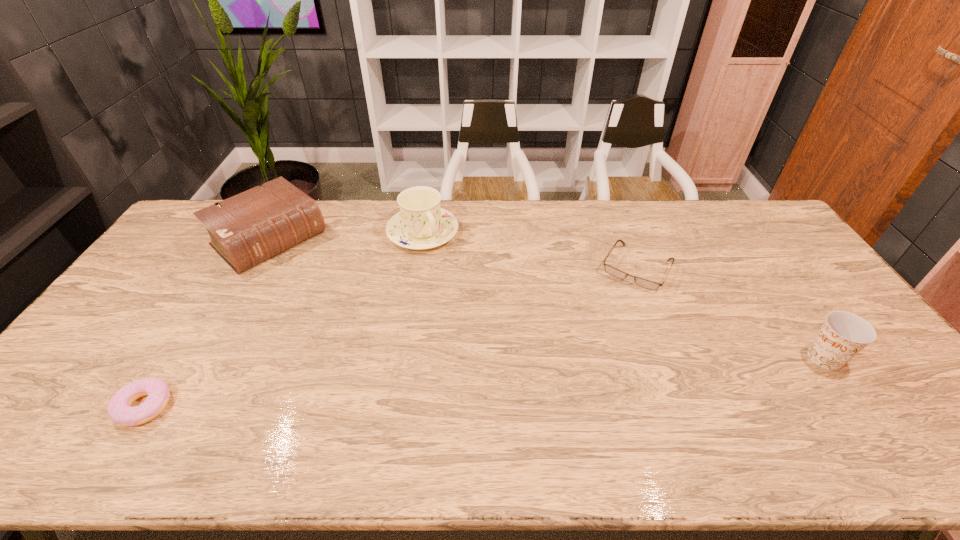
At what (x,y) coordinates should I click in order to perform the action: click on object situated at the left edge. Please return your answer as a coordinate pair (x, y). The width and height of the screenshot is (960, 540). Looking at the image, I should click on (249, 228).

The height and width of the screenshot is (540, 960). Identify the location of object situated at the right edge. (843, 335).

Where is `object located at the far left corner`? object located at the far left corner is located at coordinates (249, 228).

You are a GUI agent. You are given a task and a screenshot of the screen. Output one action in this format:
    pyautogui.click(x=<x>, y=<y>)
    Task: Click on the vacant space at the far edge of the desktop
    The width and height of the screenshot is (960, 540).
    Given the screenshot: What is the action you would take?
    pyautogui.click(x=658, y=236)

This screenshot has height=540, width=960. I want to click on vacant space at the near edge, so click(222, 400).

Where is `empty space between the chinaware and the nearest object`? empty space between the chinaware and the nearest object is located at coordinates (283, 319).

The height and width of the screenshot is (540, 960). I want to click on vacant space that is in between the chinaware and the doughnut, so click(x=283, y=319).

What are the coordinates of `free space between the second nearest object and the Bible` in the screenshot? It's located at (547, 299).

Identify the location of free spot between the doughnut and the Bible. (206, 323).

I want to click on empty space between the second object from right to left and the Dixie cup, so click(x=731, y=313).